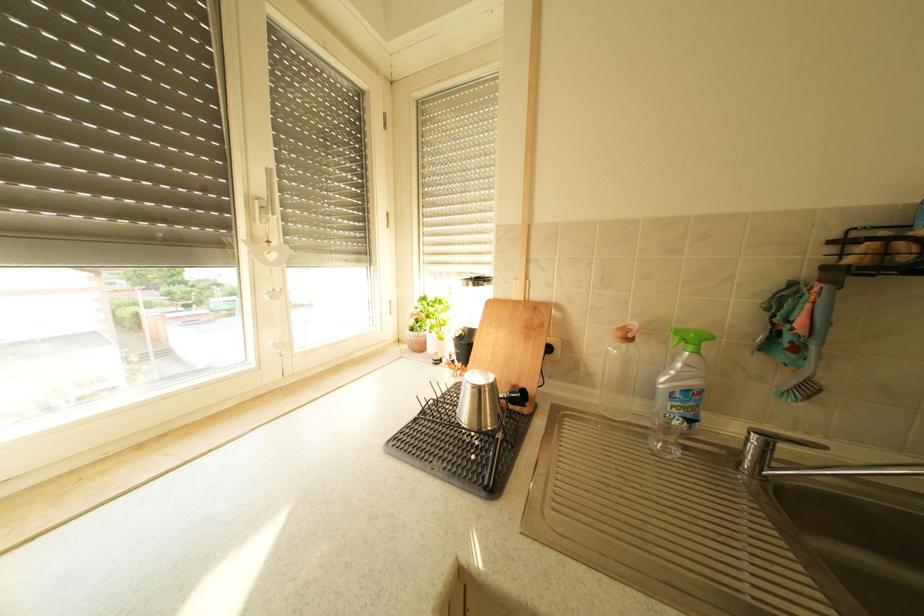
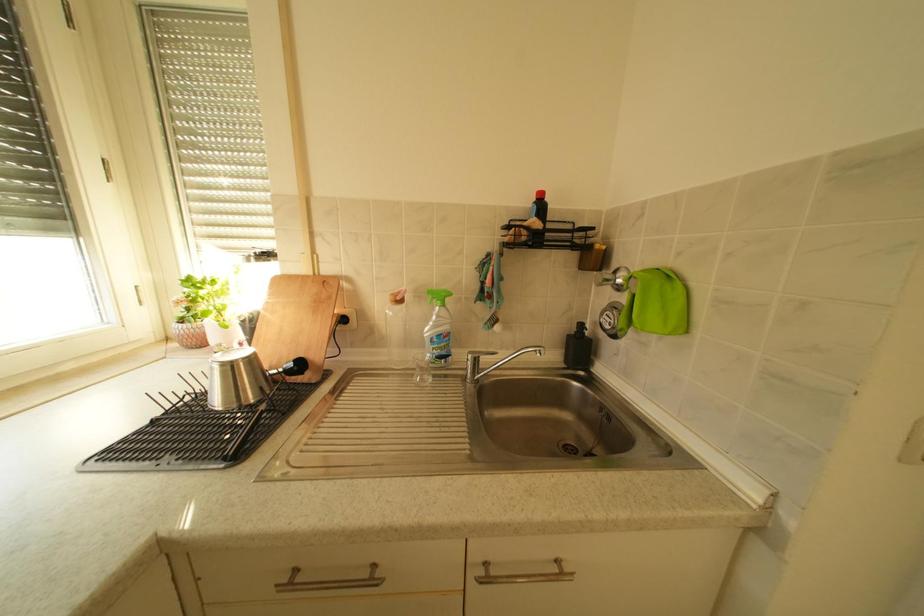
Question: The camera is either moving clockwise (left) or counter-clockwise (right) around the object. The first image is from the beginning of the video and the second image is from the end. Is the camera moving left or right when shooting the video?

Choices:
 (A) Left
 (B) Right

Answer: (A)